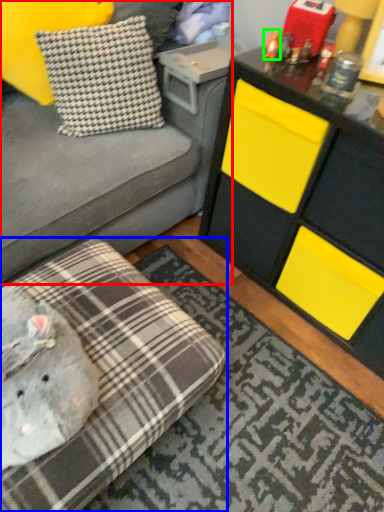
Question: Which object is positioned closest to studio couch (highlighted by a red box)? Select from studio couch (highlighted by a blue box) and toy (highlighted by a green box).

Choices:
 (A) studio couch
 (B) toy

Answer: (A)